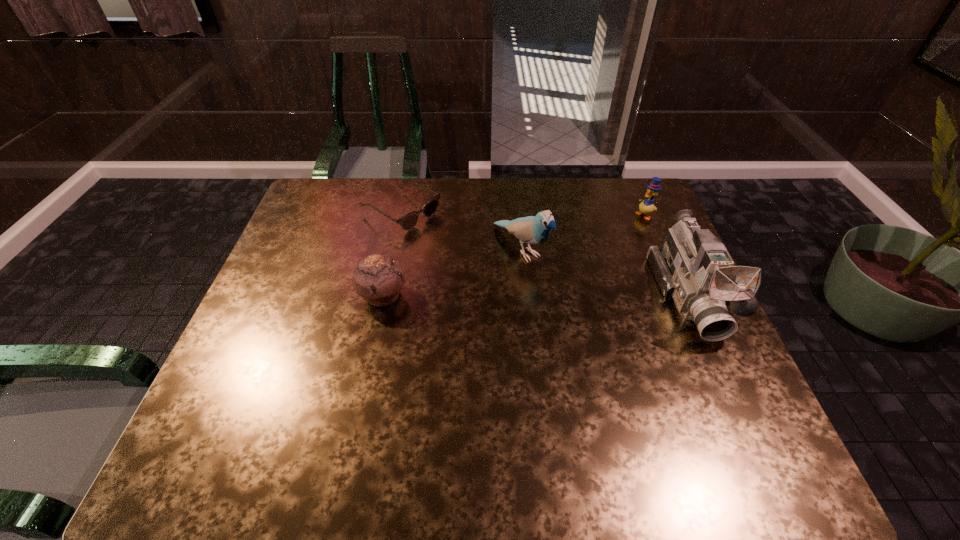
In order to click on free space located 0.370m on the front lenses of the sunglasses in this screenshot , I will do `click(527, 285)`.

Identify the location of free space located 0.350m on the front lenses of the sunglasses. The width and height of the screenshot is (960, 540). (521, 281).

This screenshot has width=960, height=540. What are the coordinates of `free space located on the front lenses of the sunglasses` in the screenshot? It's located at (516, 278).

Find the location of a particular element. The width and height of the screenshot is (960, 540). vacant area situated 0.310m on the face of the duckling, where the monocle is placed is located at coordinates pos(568,260).

Find the location of a particular element. This screenshot has height=540, width=960. vacant space located on the face of the duckling, where the monocle is placed is located at coordinates (625, 226).

The height and width of the screenshot is (540, 960). In order to click on vacant area situated on the face of the duckling, where the monocle is placed in this screenshot , I will do `click(570, 259)`.

Locate an element on the screen. sunglasses at the far edge is located at coordinates [407, 222].

Where is `duckling that is at the far edge`? The image size is (960, 540). duckling that is at the far edge is located at coordinates (646, 206).

Identify the location of camcorder that is at the right edge. This screenshot has width=960, height=540. coord(693,267).

This screenshot has width=960, height=540. Find the location of `duckling present at the right edge`. duckling present at the right edge is located at coordinates (646, 206).